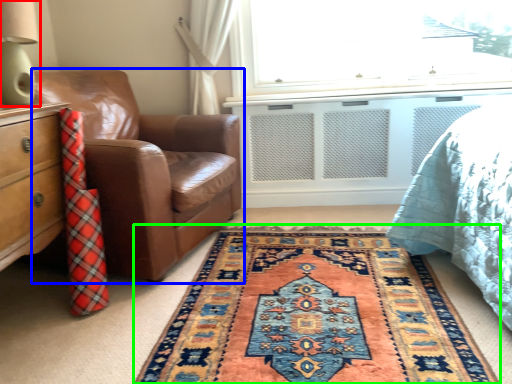
Question: Which is nearer to the table lamp (highlighted by a red box)? chair (highlighted by a blue box) or mat (highlighted by a green box).

Choices:
 (A) chair
 (B) mat

Answer: (A)